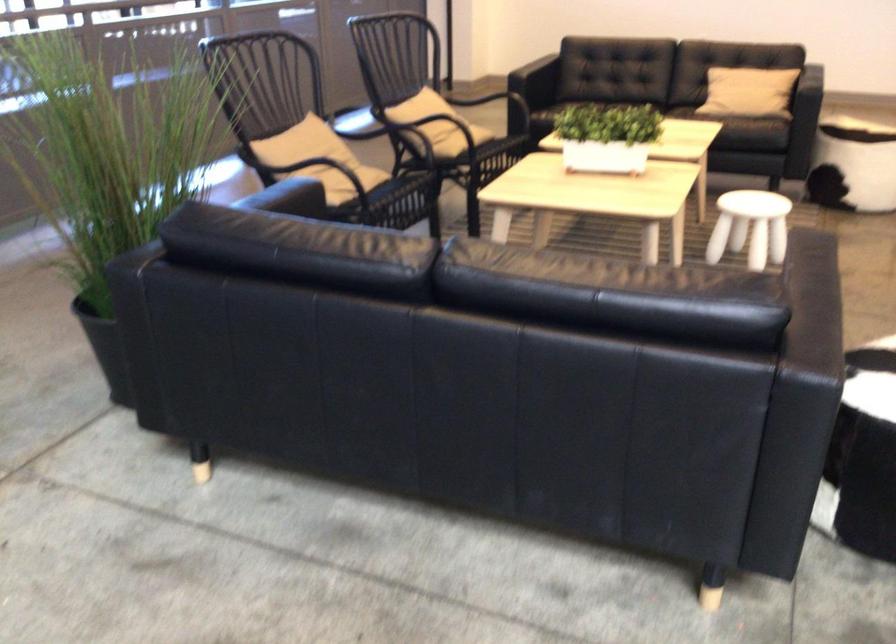
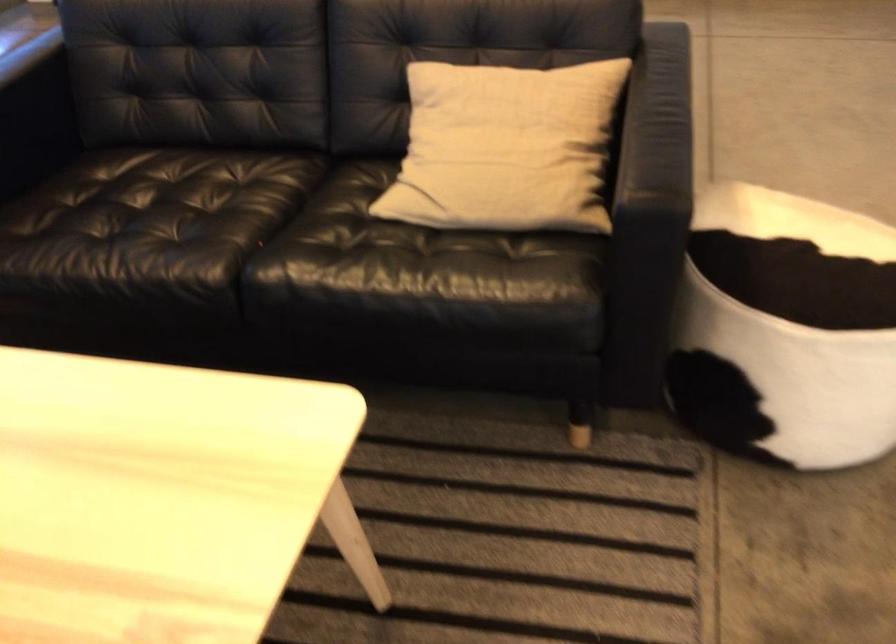
Locate, in the second image, the point that corresponds to (787,76) in the first image.

(505, 147)